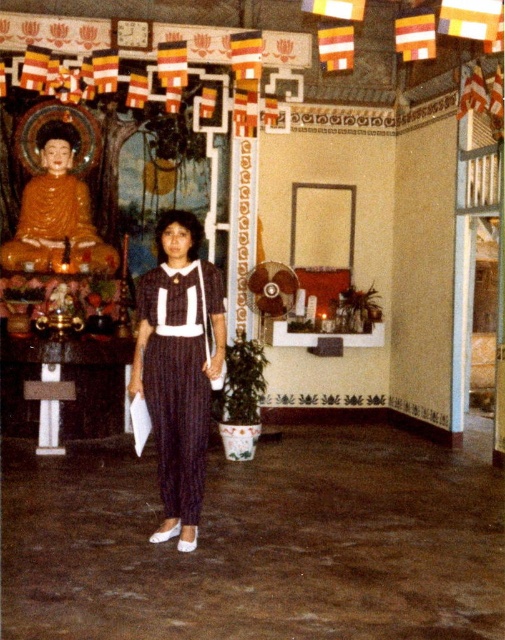
Does point (190, 403) come closer to viewer compared to point (18, 236)?

Yes, it is in front of point (18, 236).

Is point (220, 310) positioned before point (81, 244)?

Yes.

Identify the location of striped fabric dress at center. (176, 385).